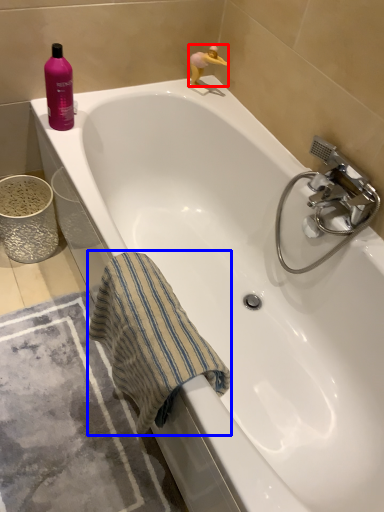
Question: Among these objects, which one is nearest to the camera, toy (highlighted by a red box) or beach towel (highlighted by a blue box)?

Choices:
 (A) toy
 (B) beach towel

Answer: (B)